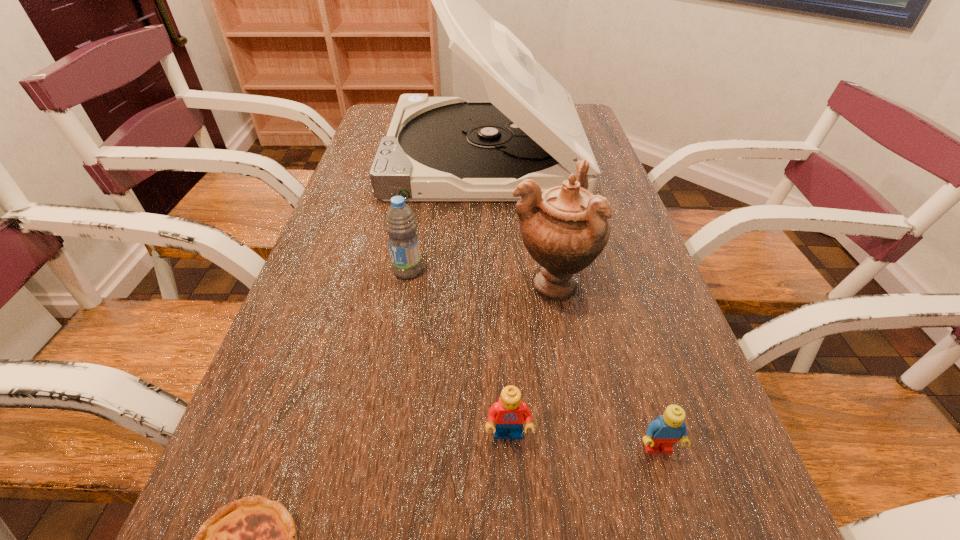
The image size is (960, 540). What are the coordinates of `the tallest object` in the screenshot? It's located at (437, 148).

The height and width of the screenshot is (540, 960). Find the location of `CD player`. CD player is located at coordinates (437, 148).

The height and width of the screenshot is (540, 960). In order to click on the second tallest object in this screenshot , I will do `click(565, 228)`.

The image size is (960, 540). In order to click on the third tallest object in this screenshot , I will do `click(400, 224)`.

Where is `the left Lego`? This screenshot has width=960, height=540. the left Lego is located at coordinates (509, 412).

I want to click on the right Lego, so click(x=662, y=433).

This screenshot has width=960, height=540. I want to click on vacant space located 0.080m on the control panel of the tallest object, so click(362, 154).

The height and width of the screenshot is (540, 960). What are the coordinates of `vacant space situated on the back of the second tallest object` in the screenshot? It's located at (539, 209).

Locate an element on the screen. Image resolution: width=960 pixels, height=540 pixels. vacant space located 0.240m on the right of the water bottle is located at coordinates (533, 271).

The image size is (960, 540). In order to click on blank area located 0.090m on the face of the left Lego in this screenshot , I will do `click(512, 510)`.